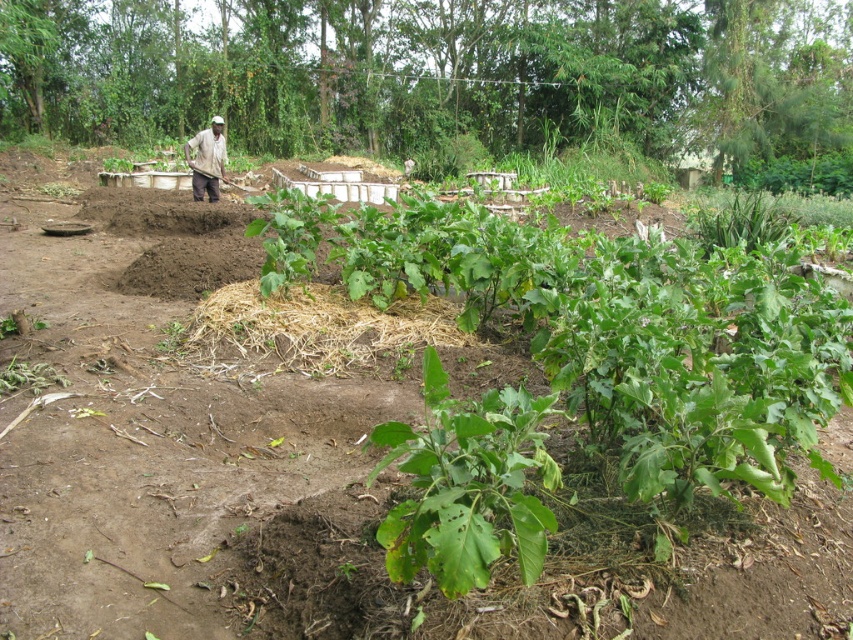
You are a farmer checking your crops. You notice the green leafy plant at center and the brown straw at center. Which one is taller?

The brown straw at center is taller than the green leafy plant at center.

You are a farmer inspecting your crops. You notice a green leafy plant at center and a dark brown skin at center. Which one is positioned more to the east in the scene?

The green leafy plant at center is to the right of dark brown skin at center, so if the scene is viewed from the north, the green leafy plant at center would be more to the east.

You are standing in the middle of the raised beds in the rural agricultural scene. You see two points marked in the image. Which point, point (x=299, y=317) or point (x=200, y=172), is closer to you?

Point (x=299, y=317) is closer to the camera than point (x=200, y=172), so it is closer to you.